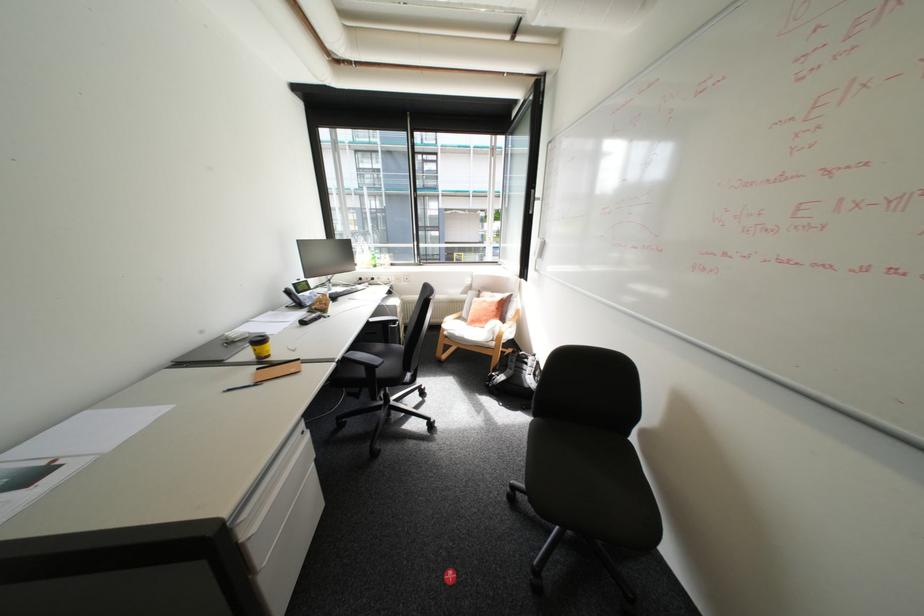
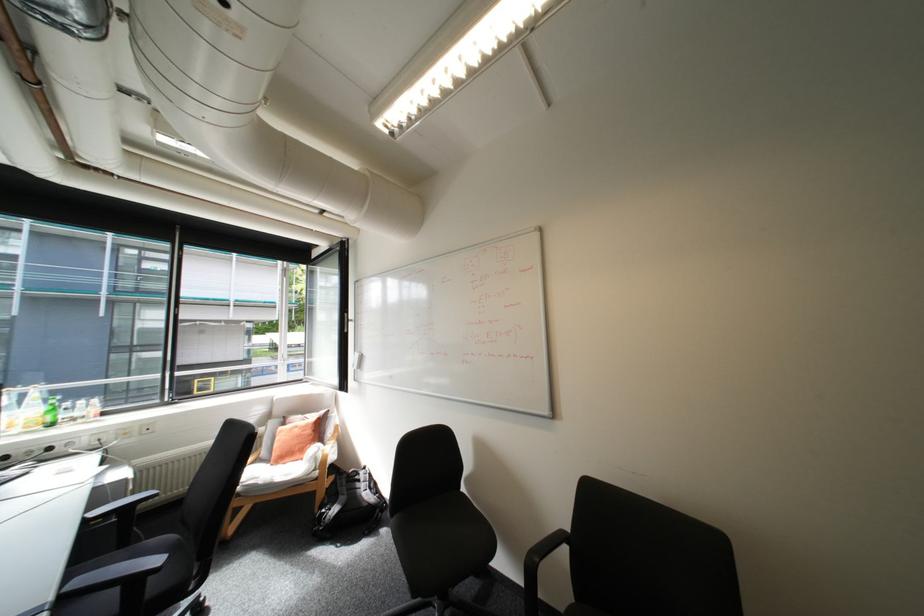
Where in the second image is the point corresponding to point (378, 265) from the first image?

(38, 427)